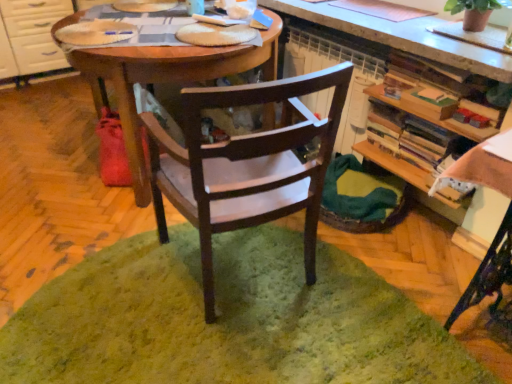
Question: From the image's perspective, is wooden desk at center on white glossy cabinet at left?

Choices:
 (A) no
 (B) yes

Answer: (A)

Question: Considering the relative sizes of wooden desk at center and white glossy cabinet at left in the image provided, is wooden desk at center shorter than white glossy cabinet at left?

Choices:
 (A) no
 (B) yes

Answer: (A)

Question: Is wooden desk at center taller than white glossy cabinet at left?

Choices:
 (A) yes
 (B) no

Answer: (A)

Question: Is white glossy cabinet at left a part of wooden desk at center?

Choices:
 (A) yes
 (B) no

Answer: (B)

Question: From a real-world perspective, is wooden desk at center physically below white glossy cabinet at left?

Choices:
 (A) no
 (B) yes

Answer: (A)

Question: From a real-world perspective, relative to wooden desk at center, is white glossy cabinet at left vertically above or below?

Choices:
 (A) below
 (B) above

Answer: (A)

Question: Is point (20, 66) closer or farther from the camera than point (138, 54)?

Choices:
 (A) farther
 (B) closer

Answer: (A)

Question: In terms of width, does white glossy cabinet at left look wider or thinner when compared to wooden desk at center?

Choices:
 (A) wide
 (B) thin

Answer: (B)

Question: Relative to wooden desk at center, is white glossy cabinet at left in front or behind?

Choices:
 (A) front
 (B) behind

Answer: (B)

Question: In terms of width, does wooden bookshelf at right look wider or thinner when compared to wooden desk at center?

Choices:
 (A) thin
 (B) wide

Answer: (A)

Question: Is wooden bookshelf at right bigger or smaller than wooden desk at center?

Choices:
 (A) small
 (B) big

Answer: (A)

Question: Is point (442, 117) positioned closer to the camera than point (279, 23)?

Choices:
 (A) closer
 (B) farther

Answer: (A)

Question: From the image's perspective, is wooden bookshelf at right positioned above or below wooden desk at center?

Choices:
 (A) below
 (B) above

Answer: (A)

Question: From a real-world perspective, is white glossy cabinet at left above or below wooden bookshelf at right?

Choices:
 (A) above
 (B) below

Answer: (B)

Question: Looking at their shapes, would you say white glossy cabinet at left is wider or thinner than wooden bookshelf at right?

Choices:
 (A) thin
 (B) wide

Answer: (B)